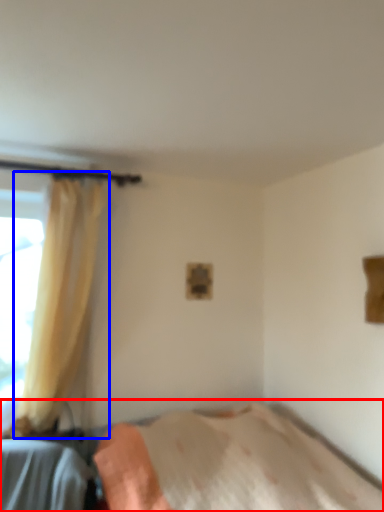
Question: Which object appears closest to the camera in this image, bed (highlighted by a red box) or curtain (highlighted by a blue box)?

Choices:
 (A) bed
 (B) curtain

Answer: (A)